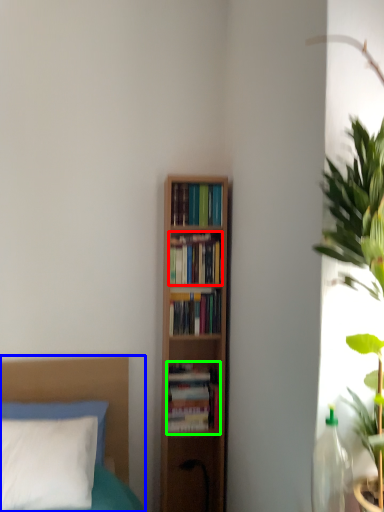
Question: Which is farther away from book (highlighted by a red box)? bed (highlighted by a blue box) or book (highlighted by a green box)?

Choices:
 (A) bed
 (B) book

Answer: (A)